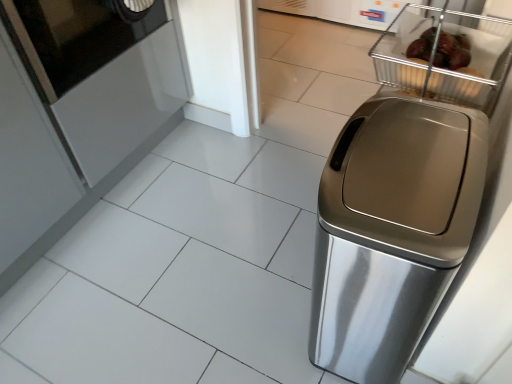
Question: From the image's perspective, is black glass screen door at upper left below metallic wire basket at upper right?

Choices:
 (A) no
 (B) yes

Answer: (A)

Question: Does black glass screen door at upper left have a smaller size compared to metallic wire basket at upper right?

Choices:
 (A) no
 (B) yes

Answer: (A)

Question: Is black glass screen door at upper left facing away from metallic wire basket at upper right?

Choices:
 (A) no
 (B) yes

Answer: (A)

Question: Does black glass screen door at upper left have a lesser height compared to metallic wire basket at upper right?

Choices:
 (A) no
 (B) yes

Answer: (A)

Question: Can metallic wire basket at upper right be found inside black glass screen door at upper left?

Choices:
 (A) yes
 (B) no

Answer: (B)

Question: Is black glass screen door at upper left behind metallic wire basket at upper right?

Choices:
 (A) yes
 (B) no

Answer: (A)

Question: Is metallic wire basket at upper right touching black glass screen door at upper left?

Choices:
 (A) yes
 (B) no

Answer: (B)

Question: Is metallic wire basket at upper right located outside black glass screen door at upper left?

Choices:
 (A) yes
 (B) no

Answer: (A)

Question: Can you confirm if metallic wire basket at upper right is wider than black glass screen door at upper left?

Choices:
 (A) no
 (B) yes

Answer: (A)

Question: Is metallic wire basket at upper right taller than black glass screen door at upper left?

Choices:
 (A) no
 (B) yes

Answer: (A)

Question: Is the position of metallic wire basket at upper right less distant than that of black glass screen door at upper left?

Choices:
 (A) no
 (B) yes

Answer: (B)

Question: Is there a large distance between metallic wire basket at upper right and black glass screen door at upper left?

Choices:
 (A) yes
 (B) no

Answer: (B)

Question: From the image's perspective, is metallic wire basket at upper right above satin silver trash can at right?

Choices:
 (A) no
 (B) yes

Answer: (B)